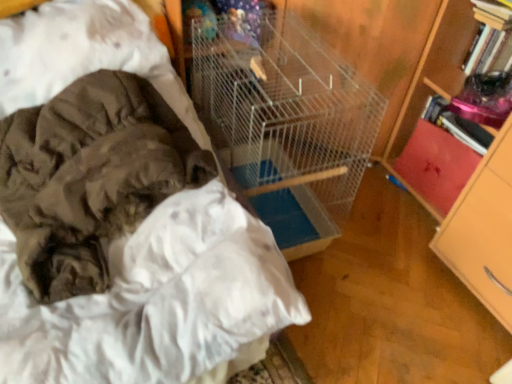
What are the coordinates of `vacant area on top of red leather book at right, which appears as the second drawer when viewed from the front (from a real-world perspective)` in the screenshot? It's located at (456, 140).